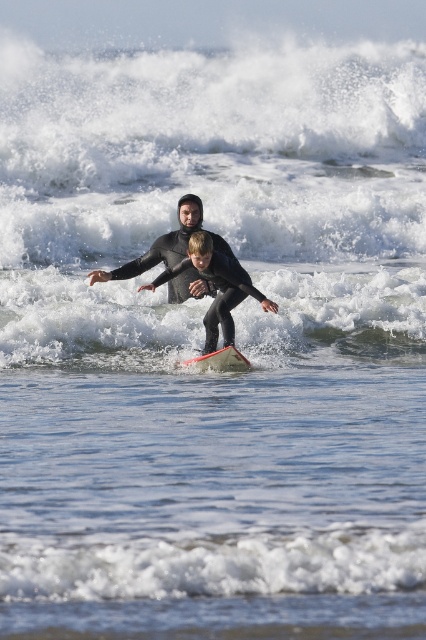
Question: Which of the following is the farthest from the observer?

Choices:
 (A) black matte wetsuit at center
 (B) orange matte surfboard at center

Answer: (B)

Question: Which point is farther to the camera?

Choices:
 (A) black matte wetsuit at center
 (B) orange matte surfboard at center

Answer: (B)

Question: Is black matte wetsuit at center below orange matte surfboard at center?

Choices:
 (A) yes
 (B) no

Answer: (B)

Question: Among these objects, which one is farthest from the camera?

Choices:
 (A) orange matte surfboard at center
 (B) black matte wetsuit at center

Answer: (A)

Question: Does black matte wetsuit at center have a larger size compared to orange matte surfboard at center?

Choices:
 (A) yes
 (B) no

Answer: (A)

Question: Where is black matte wetsuit at center located in relation to orange matte surfboard at center in the image?

Choices:
 (A) below
 (B) above

Answer: (B)